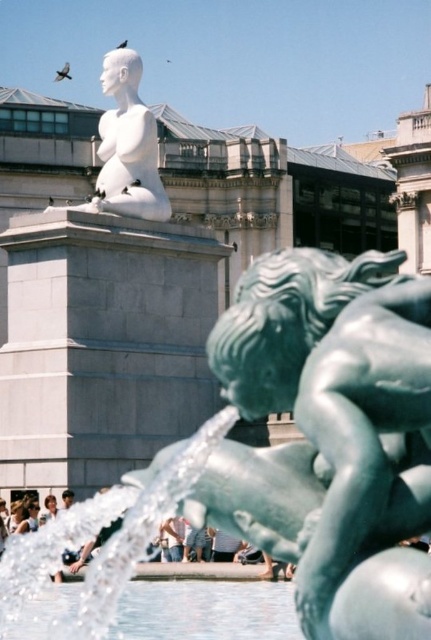
From the picture: Does clear water at fountain center appear on the left side of white marble statue at upper center?

In fact, clear water at fountain center is to the right of white marble statue at upper center.

Is clear water at fountain center smaller than white marble statue at upper center?

Correct, clear water at fountain center occupies less space than white marble statue at upper center.

The width and height of the screenshot is (431, 640). Describe the element at coordinates (206, 611) in the screenshot. I see `clear water at fountain center` at that location.

Find the location of `clear water at fountain center`. clear water at fountain center is located at coordinates (206, 611).

Does green polished stone fountain at center have a lesser width compared to white marble statue at upper center?

Correct, green polished stone fountain at center's width is less than white marble statue at upper center's.

Which is more to the left, green polished stone fountain at center or white marble statue at upper center?

From the viewer's perspective, white marble statue at upper center appears more on the left side.

Does point (274, 490) come farther from viewer compared to point (137, 125)?

No, (274, 490) is closer to viewer.

Where is `green polished stone fountain at center`? The width and height of the screenshot is (431, 640). green polished stone fountain at center is located at coordinates (331, 435).

This screenshot has width=431, height=640. Describe the element at coordinates (331, 435) in the screenshot. I see `green polished stone fountain at center` at that location.

Is green polished stone fountain at center closer to camera compared to clear water at fountain center?

Yes, it is in front of clear water at fountain center.

From the picture: Measure the distance between point [200,497] and camera.

Point [200,497] and camera are 22.36 meters apart from each other.

At what (x,y) coordinates should I click in order to perform the action: click on green polished stone fountain at center. Please return your answer as a coordinate pair (x, y). The height and width of the screenshot is (640, 431). Looking at the image, I should click on (331, 435).